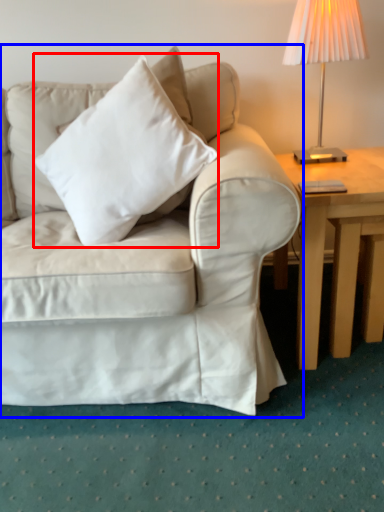
Question: Among these objects, which one is farthest to the camera, pillow (highlighted by a red box) or studio couch (highlighted by a blue box)?

Choices:
 (A) pillow
 (B) studio couch

Answer: (A)